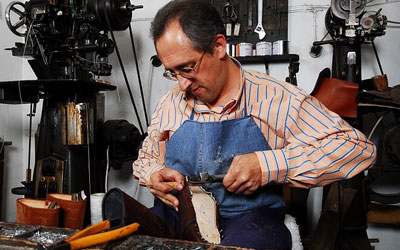
Identify the location of work table. The image size is (400, 250). (157, 245).